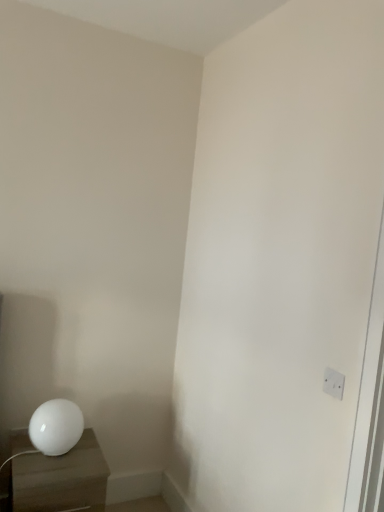
The height and width of the screenshot is (512, 384). Describe the element at coordinates (56, 426) in the screenshot. I see `white glossy sphere at lower left` at that location.

Where is `white glossy sphere at lower left`? The height and width of the screenshot is (512, 384). white glossy sphere at lower left is located at coordinates (56, 426).

The height and width of the screenshot is (512, 384). Find the location of `white glossy nightstand at lower left`. white glossy nightstand at lower left is located at coordinates (61, 479).

This screenshot has height=512, width=384. Identify the location of white glossy sphere at lower left. (56, 426).

Between white glossy sphere at lower left and white glossy nightstand at lower left, which one has more height?

white glossy nightstand at lower left.

Is white glossy nightstand at lower left at the back of white glossy sphere at lower left?

white glossy sphere at lower left does not have its back to white glossy nightstand at lower left.

Is white glossy sphere at lower left placed right next to white glossy nightstand at lower left?

No, white glossy sphere at lower left is not with white glossy nightstand at lower left.

What's the angular difference between white glossy sphere at lower left and white glossy nightstand at lower left's facing directions?

white glossy sphere at lower left and white glossy nightstand at lower left are facing 1.2 degrees away from each other.

Could you tell me if white plastic electric outlet at upper right is turned towards white glossy sphere at lower left?

No, white plastic electric outlet at upper right does not turn towards white glossy sphere at lower left.

Looking at this image, does white plastic electric outlet at upper right have a lesser width compared to white glossy sphere at lower left?

Correct, the width of white plastic electric outlet at upper right is less than that of white glossy sphere at lower left.

Does white plastic electric outlet at upper right appear on the right side of white glossy sphere at lower left?

Yes, white plastic electric outlet at upper right is to the right of white glossy sphere at lower left.

Does white plastic electric outlet at upper right touch white glossy sphere at lower left?

No, white plastic electric outlet at upper right is not in contact with white glossy sphere at lower left.

Choose the correct answer: Is white glossy nightstand at lower left inside white glossy sphere at lower left or outside it?

white glossy nightstand at lower left exists outside the volume of white glossy sphere at lower left.

From the image's perspective, which is below, white glossy nightstand at lower left or white glossy sphere at lower left?

From the image's view, white glossy nightstand at lower left is below.

How much distance is there between white glossy nightstand at lower left and white glossy sphere at lower left?

A distance of 13.48 centimeters exists between white glossy nightstand at lower left and white glossy sphere at lower left.

Consider the image. Which is more to the left, white glossy nightstand at lower left or white glossy sphere at lower left?

Positioned to the left is white glossy nightstand at lower left.

From the picture: Choose the correct answer: Is white glossy sphere at lower left inside white plastic electric outlet at upper right or outside it?

white glossy sphere at lower left is located beyond the bounds of white plastic electric outlet at upper right.

Is point (74, 445) less distant than point (328, 368)?

That is False.

Which object is more forward, white glossy sphere at lower left or white plastic electric outlet at upper right?

white plastic electric outlet at upper right is more forward.

Does white glossy sphere at lower left have a lesser height compared to white plastic electric outlet at upper right?

No.

From a real-world perspective, is white plastic electric outlet at upper right located beneath white glossy nightstand at lower left?

Actually, white plastic electric outlet at upper right is physically above white glossy nightstand at lower left in the real world.

In the scene shown: Is white plastic electric outlet at upper right closer to the viewer compared to white glossy nightstand at lower left?

Yes, white plastic electric outlet at upper right is closer to the camera.

Do you think white plastic electric outlet at upper right is within white glossy nightstand at lower left, or outside of it?

white plastic electric outlet at upper right is outside white glossy nightstand at lower left.

Locate an element on the screen. This screenshot has width=384, height=512. electric outlet above the white glossy nightstand at lower left (from the image's perspective) is located at coordinates (333, 383).

Is white glossy nightstand at lower left facing away from white plastic electric outlet at upper right?

No, white glossy nightstand at lower left is not facing the opposite direction of white plastic electric outlet at upper right.

From the image's perspective, is white glossy nightstand at lower left located above or below white plastic electric outlet at upper right?

white glossy nightstand at lower left is situated lower than white plastic electric outlet at upper right in the image.

Locate an element on the screen. This screenshot has height=512, width=384. lamp on the right of white glossy nightstand at lower left is located at coordinates (56, 426).

Where is `lamp lying behind the white plastic electric outlet at upper right`? lamp lying behind the white plastic electric outlet at upper right is located at coordinates (56, 426).

When comparing their distances from white glossy sphere at lower left, does white plastic electric outlet at upper right or white glossy nightstand at lower left seem closer?

white glossy nightstand at lower left is positioned closer to the anchor white glossy sphere at lower left.

Which object lies further to the anchor point white plastic electric outlet at upper right, white glossy sphere at lower left or white glossy nightstand at lower left?

white glossy nightstand at lower left is further to white plastic electric outlet at upper right.

Estimate the real-world distances between objects in this image. Which object is further from white glossy sphere at lower left, white glossy nightstand at lower left or white plastic electric outlet at upper right?

white plastic electric outlet at upper right is further to white glossy sphere at lower left.

Based on their spatial positions, is white glossy sphere at lower left or white plastic electric outlet at upper right further from white glossy nightstand at lower left?

Among the two, white plastic electric outlet at upper right is located further to white glossy nightstand at lower left.

When comparing their distances from white plastic electric outlet at upper right, does white glossy nightstand at lower left or white glossy sphere at lower left seem closer?

The object closer to white plastic electric outlet at upper right is white glossy sphere at lower left.

Which object lies nearer to the anchor point white glossy nightstand at lower left, white plastic electric outlet at upper right or white glossy sphere at lower left?

white glossy sphere at lower left.

This screenshot has height=512, width=384. What are the coordinates of `lamp located between white glossy nightstand at lower left and white plastic electric outlet at upper right in the left-right direction` in the screenshot? It's located at (56, 426).